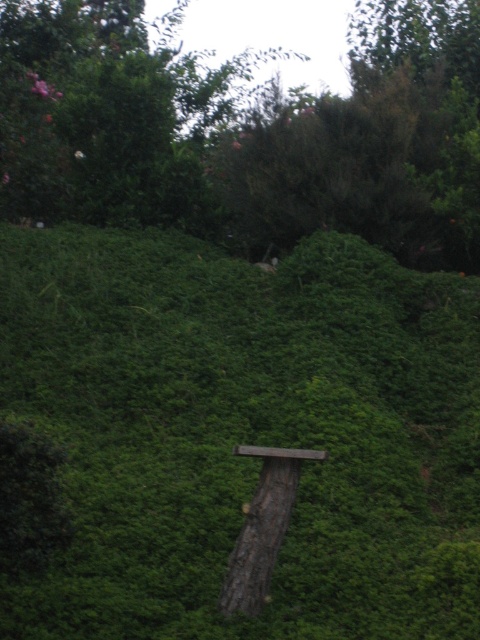
Question: Among these objects, which one is nearest to the camera?

Choices:
 (A) green leafy tree at center
 (B) green leafy hedge at center

Answer: (B)

Question: Is green leafy tree at center bigger than brown rough tree trunk at center?

Choices:
 (A) yes
 (B) no

Answer: (A)

Question: Which point is closer to the camera taking this photo?

Choices:
 (A) (74, 198)
 (B) (316, 372)

Answer: (B)

Question: Is green leafy tree at center to the right of brown rough tree trunk at center from the viewer's perspective?

Choices:
 (A) no
 (B) yes

Answer: (A)

Question: Among these points, which one is farthest from the camera?

Choices:
 (A) (265, 557)
 (B) (316, 333)

Answer: (B)

Question: Does green leafy tree at center appear on the left side of brown rough tree trunk at center?

Choices:
 (A) yes
 (B) no

Answer: (A)